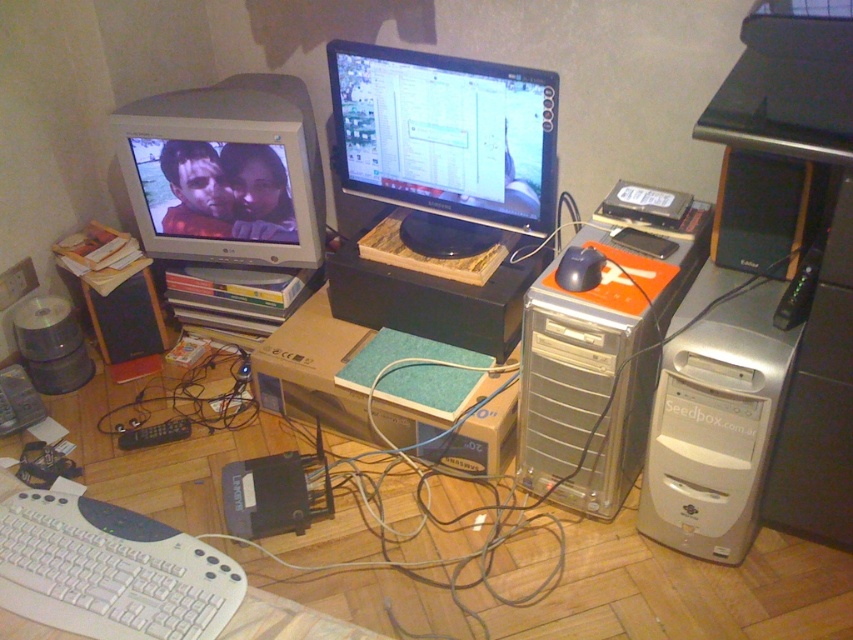
Question: Can you confirm if green cardboard box at center is positioned to the left of black plastic speaker at left?

Choices:
 (A) no
 (B) yes

Answer: (A)

Question: In this image, where is white plastic keyboard at lower left located relative to green cardboard box at center?

Choices:
 (A) right
 (B) left

Answer: (B)

Question: Estimate the real-world distances between objects in this image. Which object is farther from the matte black monitor at center?

Choices:
 (A) silver metallic computer tower at right
 (B) black matte mouse at center
 (C) green cardboard box at center
 (D) black plastic speaker at left

Answer: (D)

Question: Considering the real-world distances, which object is farthest from the black plastic speaker at left?

Choices:
 (A) matte black monitor at center
 (B) transparent plastic computer tower at center-right

Answer: (B)

Question: Which of the following is the farthest from the observer?

Choices:
 (A) (440, 449)
 (B) (610, 467)
 (C) (76, 525)

Answer: (A)

Question: Observing the image, what is the correct spatial positioning of matte silver monitor at left in reference to black matte mouse at center?

Choices:
 (A) left
 (B) right

Answer: (A)